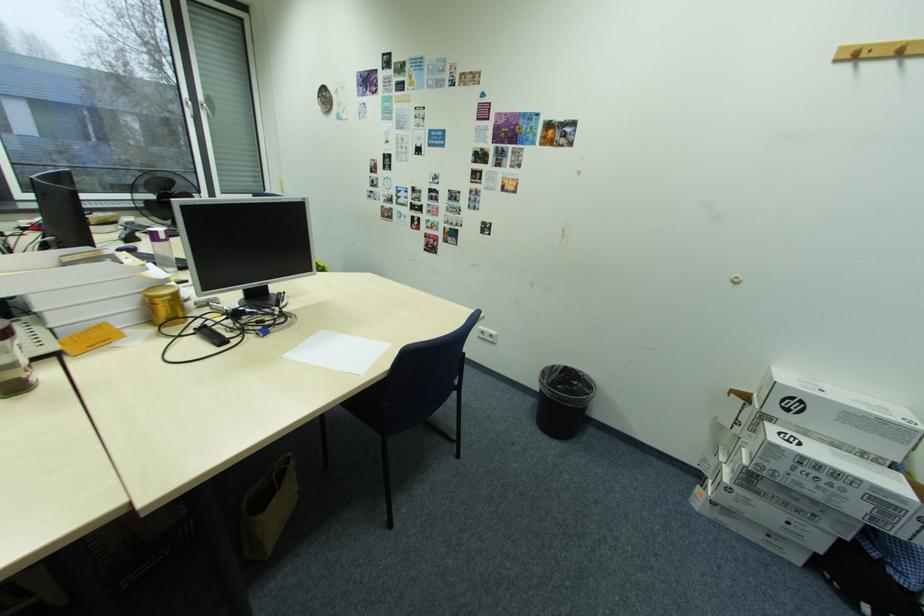
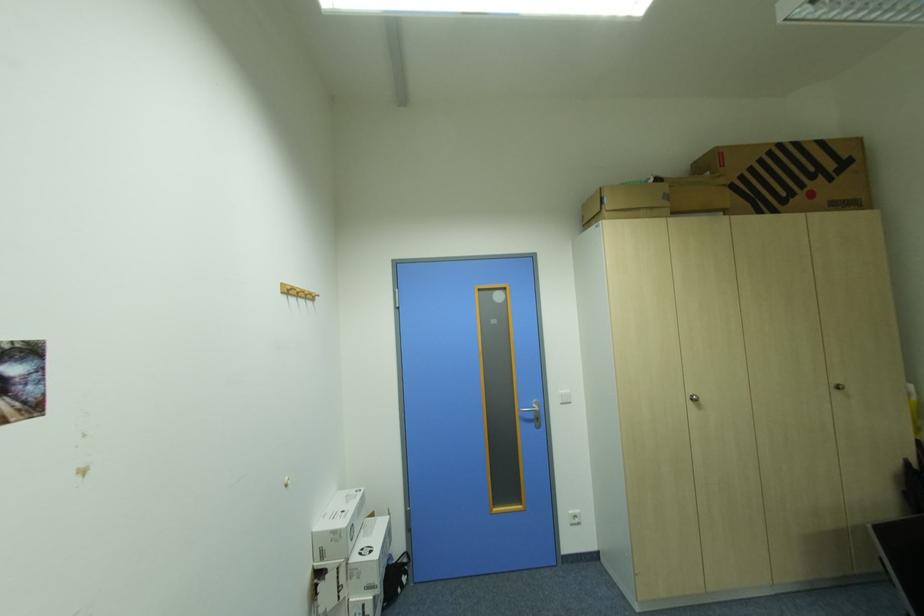
The point at [758,455] is marked in the first image. Where is the corresponding point in the second image?

(377, 590)